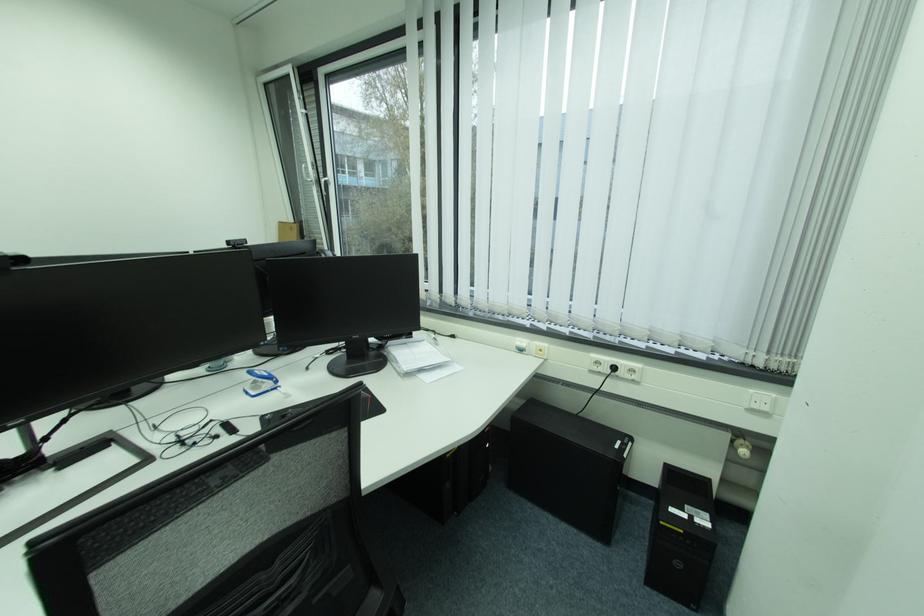
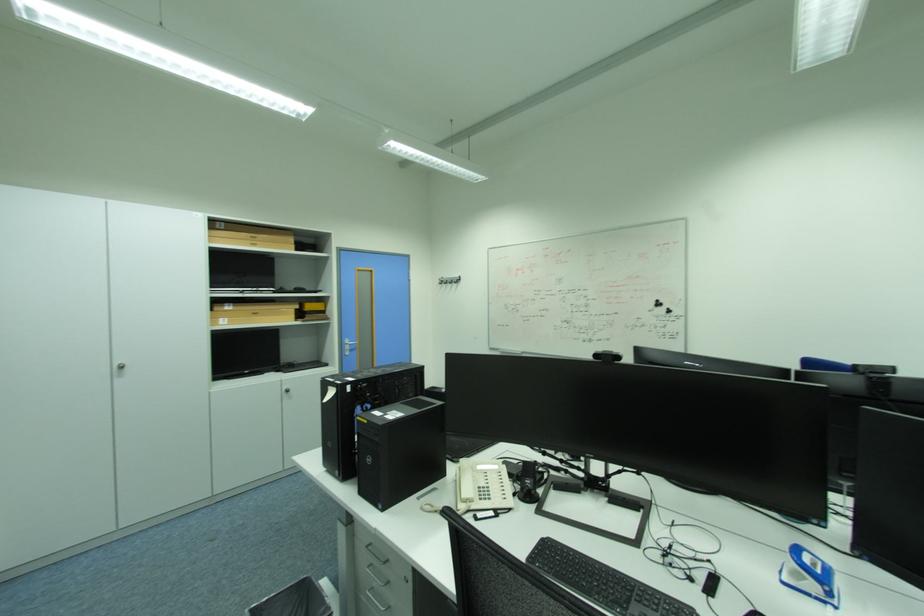
In the second image, find the point that corresponds to pixel 283 389 in the first image.

(833, 604)